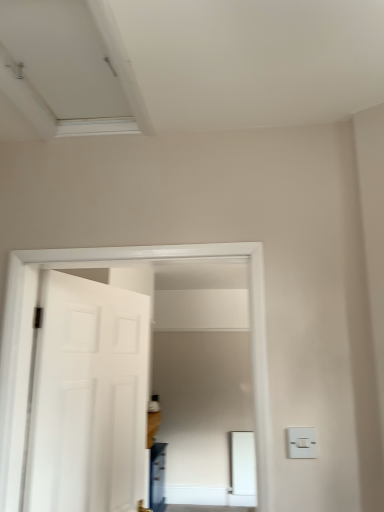
Question: Could you tell me if white plastic light switch at lower right is facing white matte door at left?

Choices:
 (A) no
 (B) yes

Answer: (A)

Question: From the image's perspective, does white plastic light switch at lower right appear lower than white matte door at left?

Choices:
 (A) no
 (B) yes

Answer: (A)

Question: Is white plastic light switch at lower right wider than white matte door at left?

Choices:
 (A) yes
 (B) no

Answer: (B)

Question: Can you see white plastic light switch at lower right touching white matte door at left?

Choices:
 (A) no
 (B) yes

Answer: (A)

Question: Are white plastic light switch at lower right and white matte door at left far apart?

Choices:
 (A) no
 (B) yes

Answer: (A)

Question: Considering the positions of point (311, 438) and point (44, 14), is point (311, 438) closer or farther from the camera than point (44, 14)?

Choices:
 (A) farther
 (B) closer

Answer: (A)

Question: Is white plastic light switch at lower right situated inside white matte exhaust hood at upper left or outside?

Choices:
 (A) outside
 (B) inside

Answer: (A)

Question: Looking at their shapes, would you say white plastic light switch at lower right is wider or thinner than white matte exhaust hood at upper left?

Choices:
 (A) wide
 (B) thin

Answer: (B)

Question: In the image, is white plastic light switch at lower right positioned in front of or behind white matte exhaust hood at upper left?

Choices:
 (A) front
 (B) behind

Answer: (B)

Question: From their relative heights in the image, would you say white matte door at left is taller or shorter than white plastic light switch at lower right?

Choices:
 (A) tall
 (B) short

Answer: (A)

Question: From a real-world perspective, relative to white plastic light switch at lower right, is white matte door at left vertically above or below?

Choices:
 (A) above
 (B) below

Answer: (A)

Question: Choose the correct answer: Is white matte door at left inside white plastic light switch at lower right or outside it?

Choices:
 (A) outside
 (B) inside

Answer: (A)

Question: Considering the relative positions of white matte door at left and white plastic light switch at lower right in the image provided, is white matte door at left to the left or to the right of white plastic light switch at lower right?

Choices:
 (A) left
 (B) right

Answer: (A)

Question: Based on their positions, is white matte door at left located to the left or right of white matte exhaust hood at upper left?

Choices:
 (A) right
 (B) left

Answer: (B)

Question: Is white matte door at left bigger or smaller than white matte exhaust hood at upper left?

Choices:
 (A) small
 (B) big

Answer: (B)